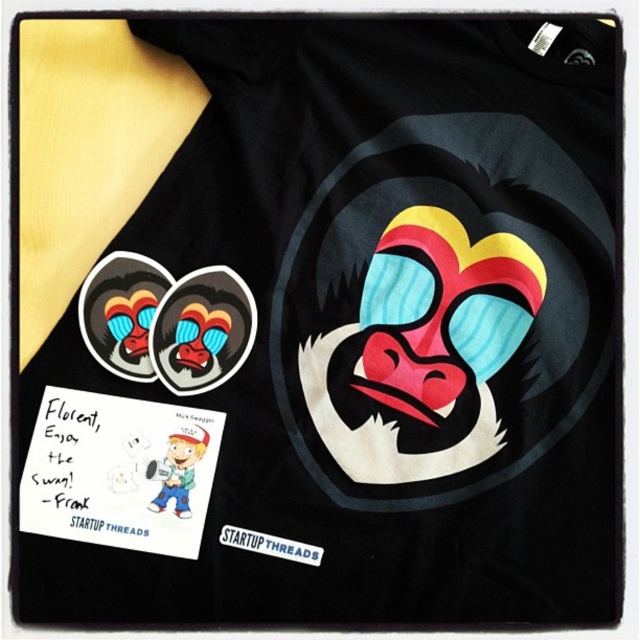
What do you see at coordinates (166, 323) in the screenshot?
I see `matte rubber monkey face at upper left` at bounding box center [166, 323].

Can you confirm if matte rubber monkey face at upper left is wider than white matte sticker at center?

Indeed, matte rubber monkey face at upper left has a greater width compared to white matte sticker at center.

Image resolution: width=640 pixels, height=640 pixels. I want to click on matte rubber monkey face at upper left, so point(166,323).

Where is `matte rubber monkey face at upper left`? The width and height of the screenshot is (640, 640). matte rubber monkey face at upper left is located at coordinates (166, 323).

Does white paper at upper left appear on the left side of matte rubber monkey face at upper left?

Correct, you'll find white paper at upper left to the left of matte rubber monkey face at upper left.

Which is behind, point (179, 515) or point (168, 275)?

Positioned behind is point (168, 275).

Is point (195, 419) behind point (232, 294)?

No, it is in front of (232, 294).

I want to click on white paper at upper left, so click(120, 472).

Does point (45, 456) come closer to viewer compared to point (262, 536)?

That is True.

Who is positioned more to the left, white paper at upper left or white matte sticker at center?

From the viewer's perspective, white paper at upper left appears more on the left side.

Who is more forward, (65, 509) or (314, 556)?

Point (65, 509)

Identify the location of white paper at upper left. (120, 472).